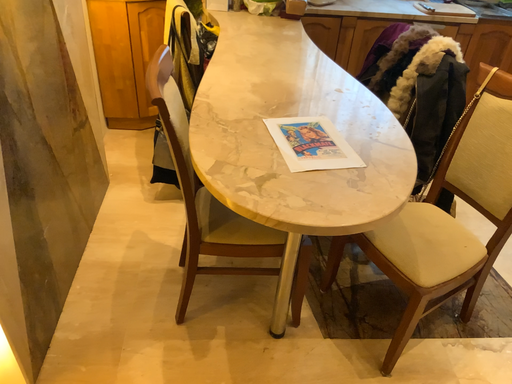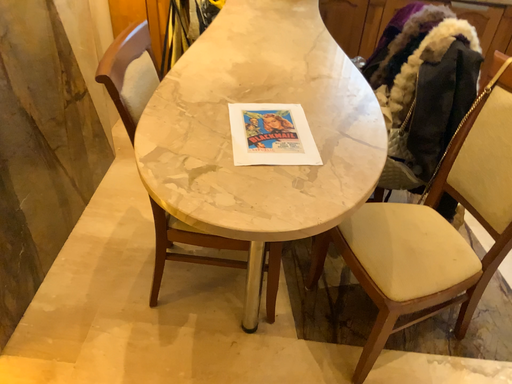
Question: Which way did the camera rotate in the video?

Choices:
 (A) rotated left
 (B) rotated right

Answer: (A)